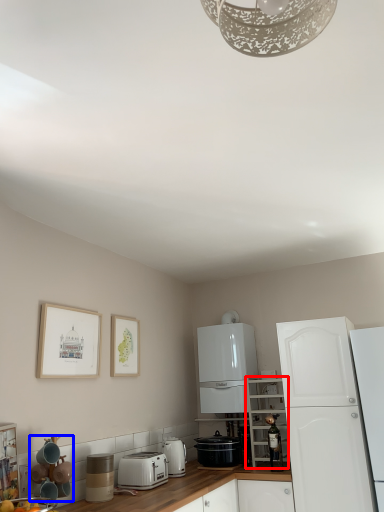
Question: Which object is further to the camera taking this photo, cabinetry (highlighted by a red box) or appliance (highlighted by a blue box)?

Choices:
 (A) cabinetry
 (B) appliance

Answer: (A)